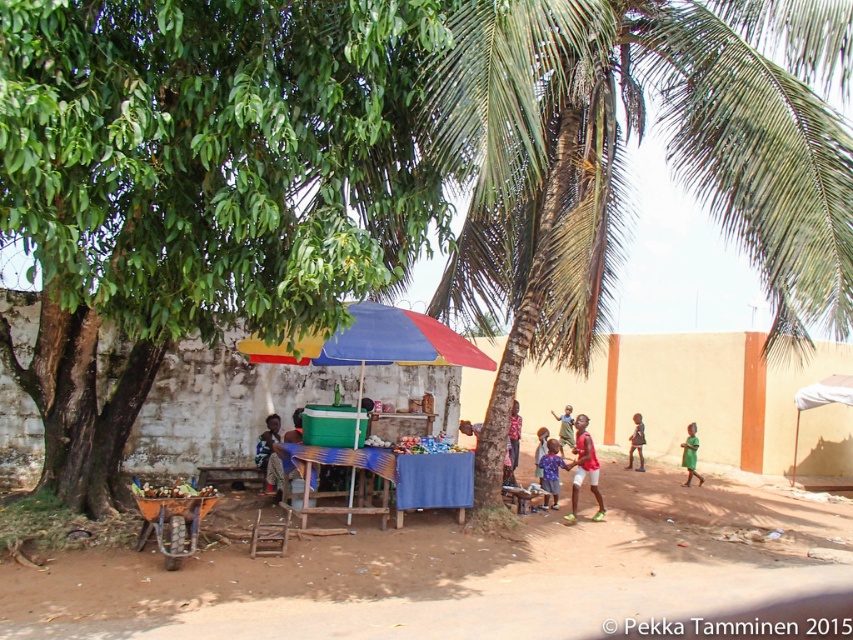
Question: From the image, what is the correct spatial relationship of blue fabric umbrella at center in relation to dark blue fabric at lower left?

Choices:
 (A) below
 (B) above

Answer: (B)

Question: Which point appears farthest from the camera in this image?

Choices:
 (A) click(393, 474)
 (B) click(628, 460)
 (C) click(541, 474)
 (D) click(686, 438)

Answer: (B)

Question: Which object is the closest to the light brown wooden stick at center?

Choices:
 (A) blue fabric shirt at center
 (B) blue fabric umbrella at center
 (C) green fabric dress at lower right
 (D) light brown skin at center

Answer: (D)

Question: Is the position of brown dirt field at center less distant than that of blue fabric umbrella at center?

Choices:
 (A) no
 (B) yes

Answer: (B)

Question: Estimate the real-world distances between objects in this image. Which object is closer to the light brown wooden stick at center?

Choices:
 (A) light brown wooden chair at center
 (B) green fabric dress at lower right
 (C) light brown skin at center
 (D) dark blue fabric at lower left

Answer: (C)

Question: Considering the relative positions of white cotton shirt at center and red fabric shirt at center in the image provided, where is white cotton shirt at center located with respect to red fabric shirt at center?

Choices:
 (A) above
 (B) below

Answer: (B)